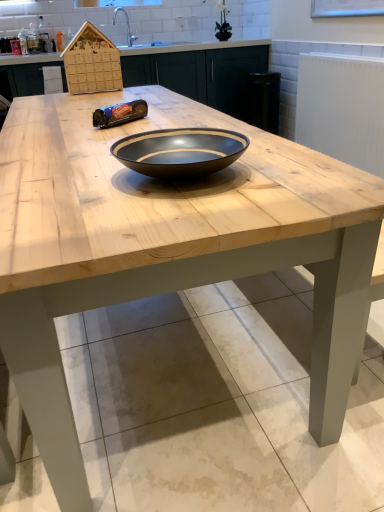
Locate an element on the screen. The width and height of the screenshot is (384, 512). vacant space in front of black glossy bowl at center is located at coordinates (168, 212).